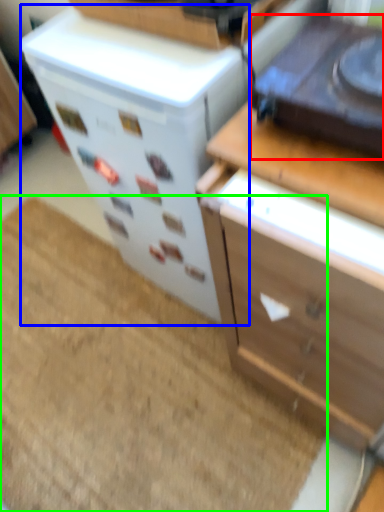
Question: Based on their relative distances, which object is nearer to appliance (highlighted by a red box)? Choose from appliance (highlighted by a blue box) and doormat (highlighted by a green box).

Choices:
 (A) appliance
 (B) doormat

Answer: (A)